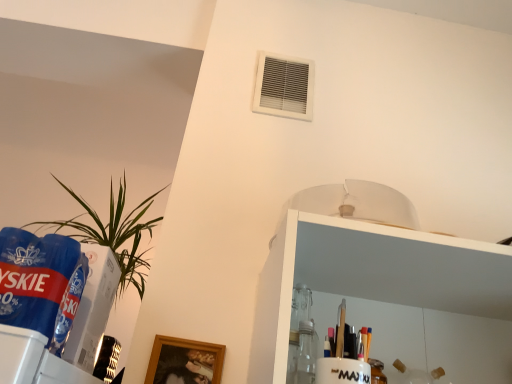
Question: From a real-world perspective, is white plastic air conditioning at upper center above or below green leafy plant at left?

Choices:
 (A) below
 (B) above

Answer: (B)

Question: Is point (288, 86) positioned closer to the camera than point (71, 223)?

Choices:
 (A) farther
 (B) closer

Answer: (B)

Question: Which is farther from the white plastic air conditioning at upper center?

Choices:
 (A) green leafy plant at left
 (B) blue plastic beverage at left

Answer: (B)

Question: Based on their relative distances, which object is nearer to the blue plastic beverage at left?

Choices:
 (A) green leafy plant at left
 (B) white plastic air conditioning at upper center

Answer: (A)